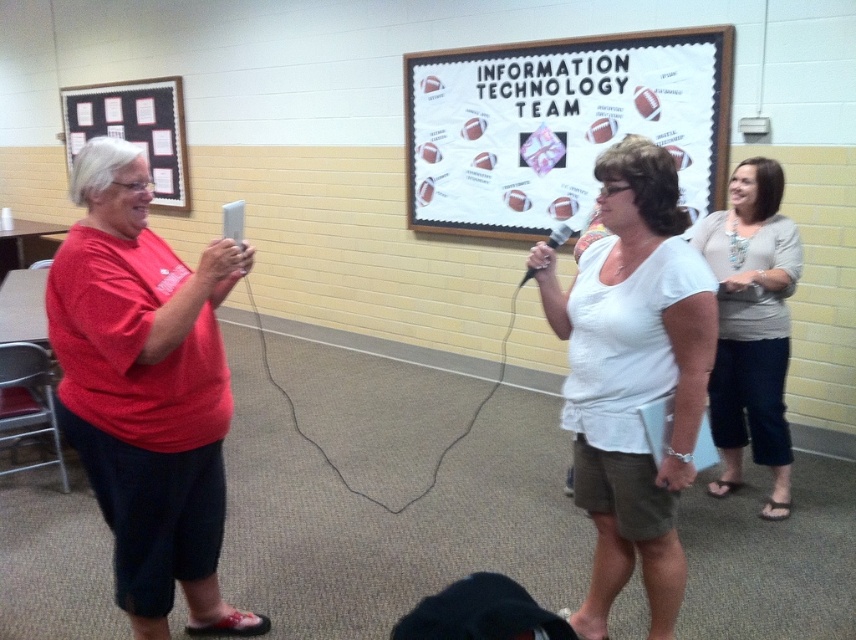
Which is more to the left, cardboard paper at upper left or black plastic microphone at center?

cardboard paper at upper left

Does cardboard paper at upper left appear on the right side of black plastic microphone at center?

Incorrect, cardboard paper at upper left is not on the right side of black plastic microphone at center.

This screenshot has width=856, height=640. Describe the element at coordinates (134, 129) in the screenshot. I see `cardboard paper at upper left` at that location.

Find the location of `cardboard paper at upper left`. cardboard paper at upper left is located at coordinates (134, 129).

Which is behind, point (482, 49) or point (730, 417)?

Positioned behind is point (482, 49).

Does point (476, 193) come closer to viewer compared to point (771, 301)?

No, (476, 193) is further to viewer.

At what (x,y) coordinates should I click in order to perform the action: click on white paperboard at center. Please return your answer as a coordinate pair (x, y). The height and width of the screenshot is (640, 856). Looking at the image, I should click on (557, 124).

Does white matte shirt at center appear under black plastic microphone at center?

Yes, white matte shirt at center is below black plastic microphone at center.

At what (x,y) coordinates should I click in order to perform the action: click on white matte shirt at center. Please return your answer as a coordinate pair (x, y). Looking at the image, I should click on (632, 376).

Locate an element on the screen. The width and height of the screenshot is (856, 640). white matte shirt at center is located at coordinates (632, 376).